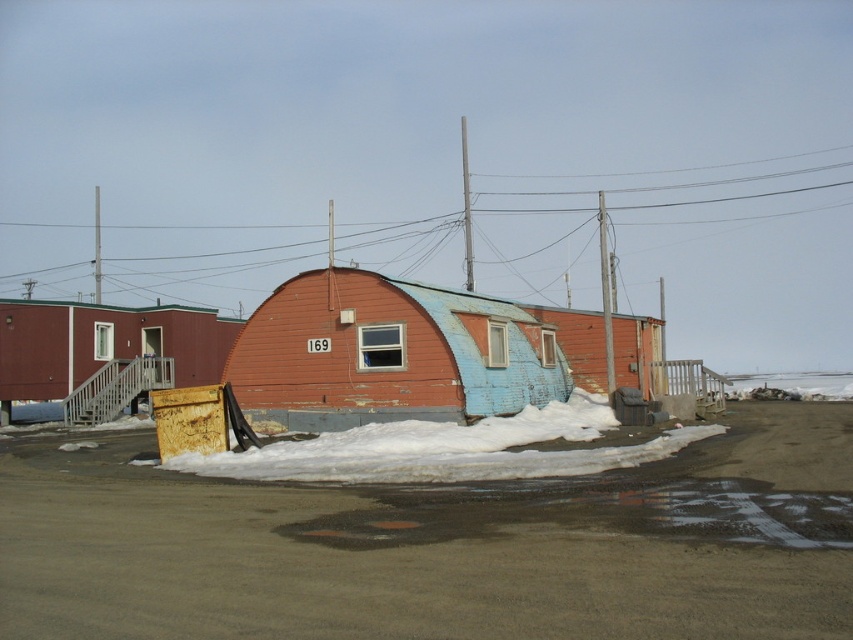
You are standing at the edge of the white powdery snow at center and want to reach the rusty corrugated metal hut at center. Which direction should you move to get there?

The rusty corrugated metal hut at center is to the right of white powdery snow at center, so you should move to the right to reach it.

From the picture: You are standing in front of the rusty corrugated metal hut at center and want to walk to the rusty metal dumpster at left. Which direction should you move relative to the hut?

The rusty corrugated metal hut at center is in front of the rusty metal dumpster at left, so to reach the dumpster, you should move backward away from the hut towards the dumpster.

You are planning to place a new bench in the area between the rusty corrugated metal hut at center and the rusty metal dumpster at left. Based on their widths, can you determine if there is enough space for the bench if it requires 2 meters of width?

The rusty corrugated metal hut at center might be wider than the rusty metal dumpster at left, but without exact measurements, it is uncertain if the space between them can accommodate a 2 meter wide bench.